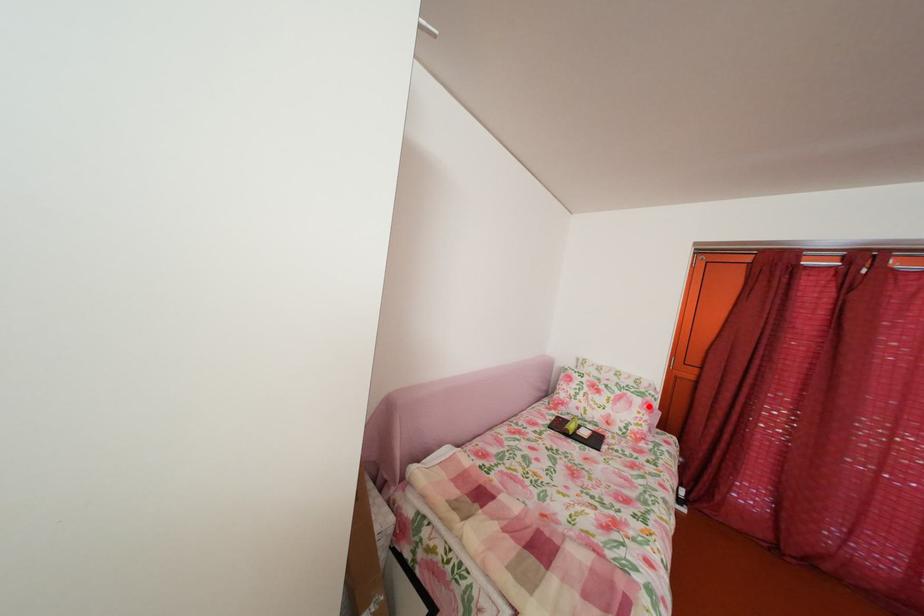
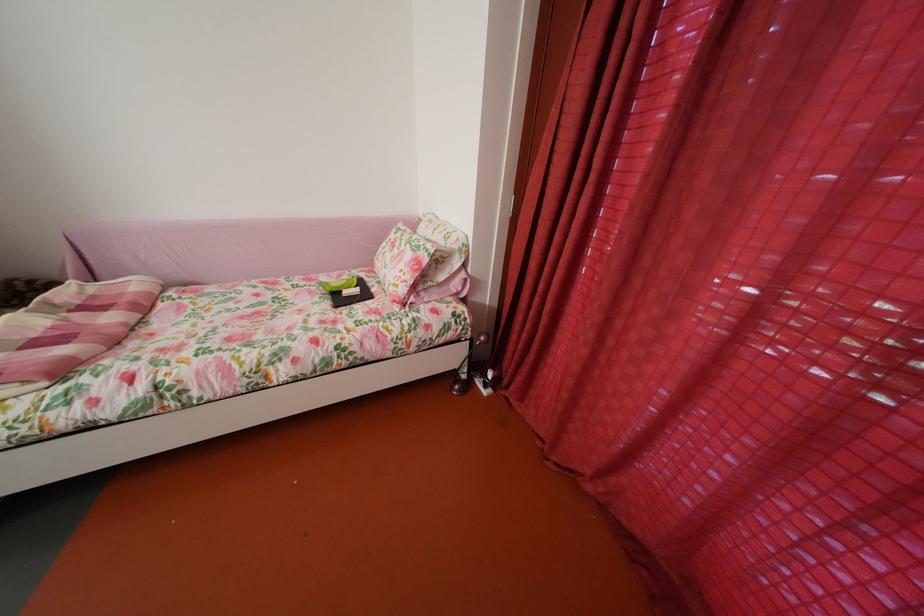
Question: A red point is marked in image1. In image2, is the corresponding 3D point closer to the camera or farther? Reply with the corresponding letter.

Choices:
 (A) The corresponding 3D point is closer.
 (B) The corresponding 3D point is farther.

Answer: (A)